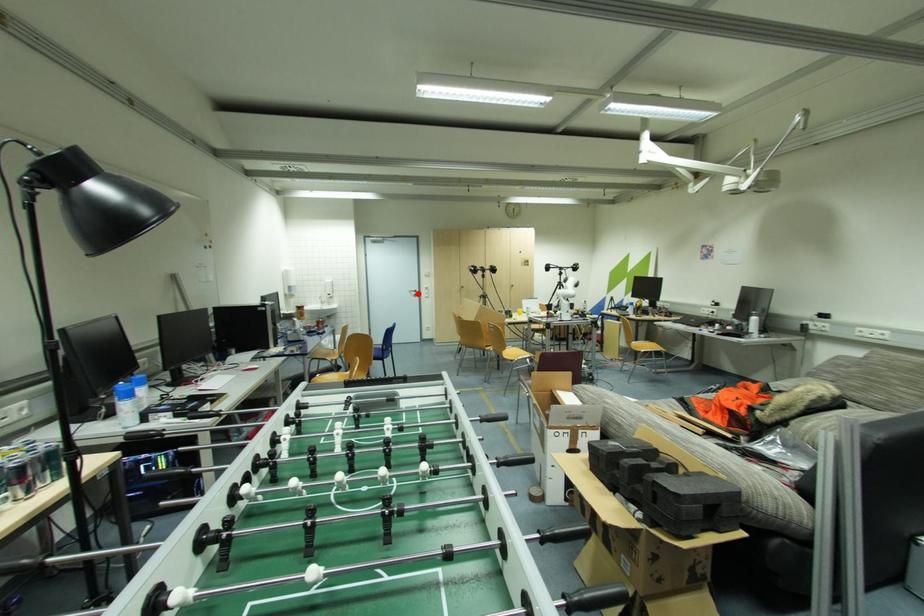
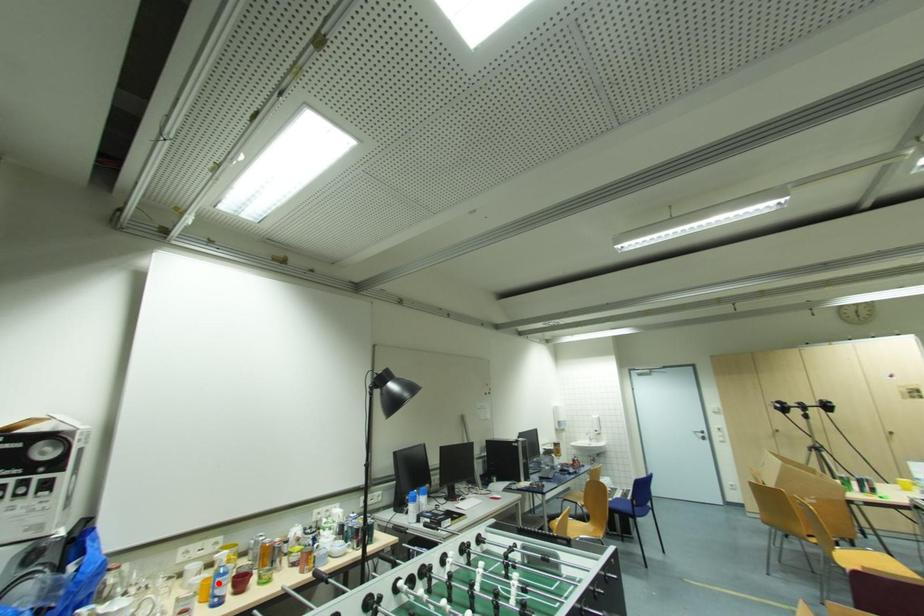
I am providing you with two images of the same scene from different viewpoints. A red point is marked on the first image and another point is marked on the second image. Is the marked point in image1 the same physical position as the marked point in image2?

No